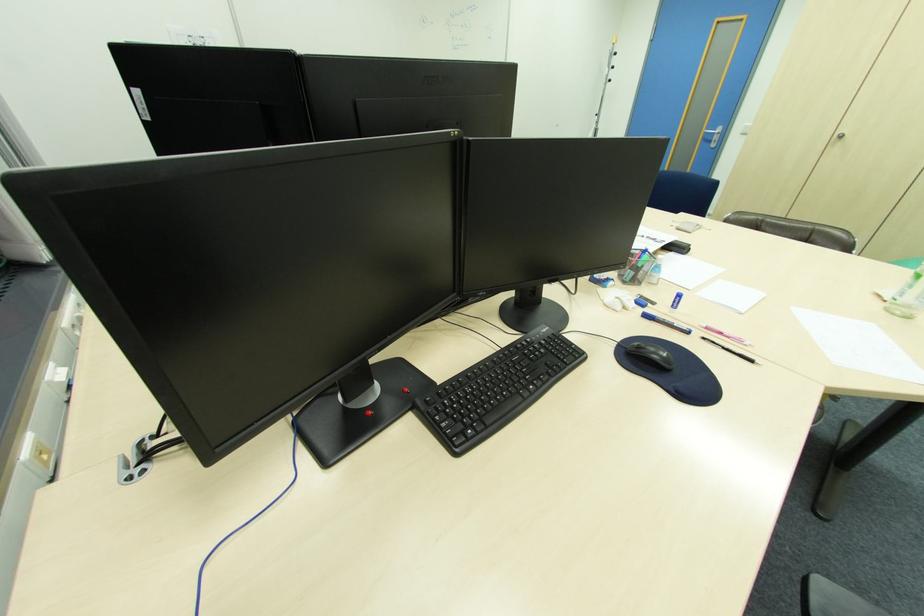
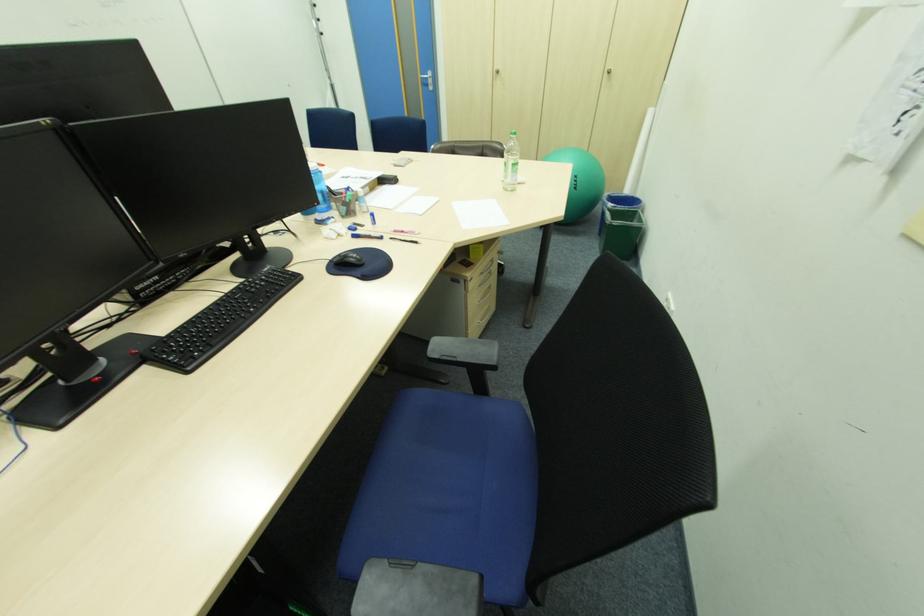
The point at (x=709, y=339) is marked in the first image. Where is the corresponding point in the second image?

(396, 238)